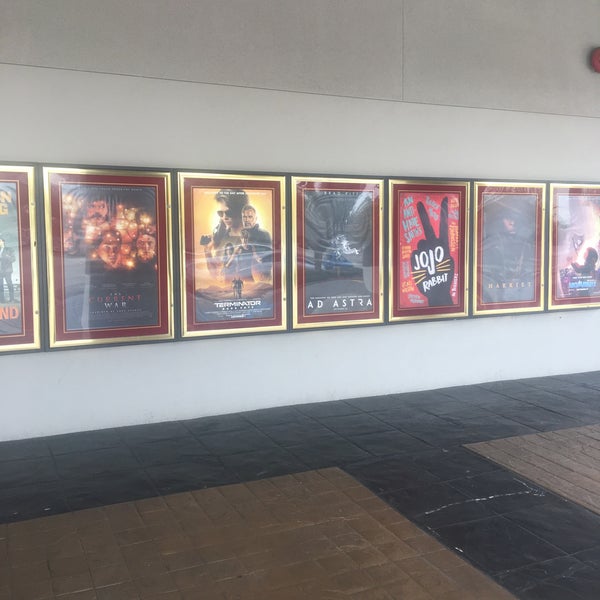
Find the location of a particular element. The height and width of the screenshot is (600, 600). floor is located at coordinates click(x=430, y=490).